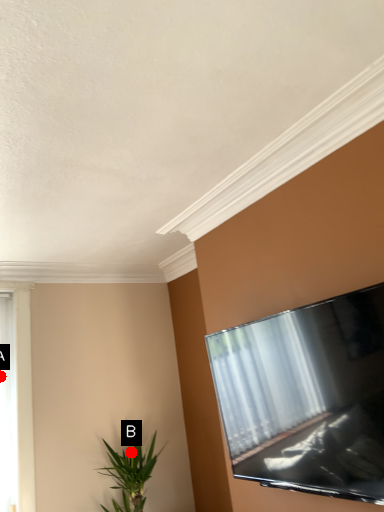
Question: Two points are circled on the image, labeled by A and B beside each circle. Which point appears farthest from the camera in this image?

Choices:
 (A) A is further
 (B) B is further

Answer: (A)